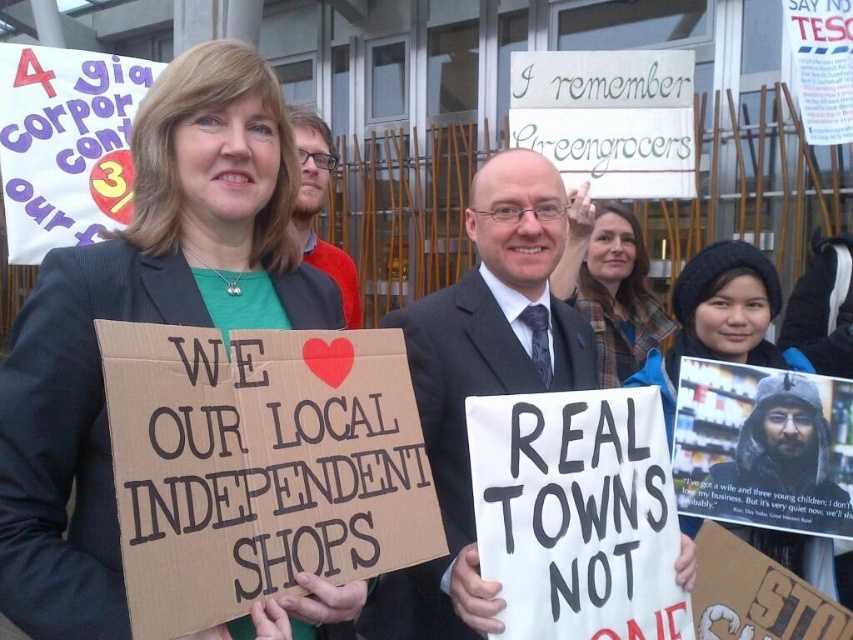
Can you confirm if blue knit hat at upper right is thinner than bearded man with glasses at center?

No.

Which of these two, blue knit hat at upper right or bearded man with glasses at center, stands shorter?

bearded man with glasses at center

Is point (726, 250) more distant than point (326, 269)?

No.

In order to click on blue knit hat at upper right in this screenshot , I will do `click(720, 320)`.

Between point (13, 522) and point (811, 554), which one is positioned behind?

Point (811, 554)

This screenshot has width=853, height=640. Describe the element at coordinates (143, 321) in the screenshot. I see `matte black blazer at center` at that location.

Describe the element at coordinates (143, 321) in the screenshot. I see `matte black blazer at center` at that location.

Where is `matte black blazer at center`? matte black blazer at center is located at coordinates (143, 321).

Who is positioned more to the left, matte black blazer at center or dark gray suit at center?

Positioned to the left is matte black blazer at center.

Which is more to the right, matte black blazer at center or dark gray suit at center?

Positioned to the right is dark gray suit at center.

This screenshot has width=853, height=640. What do you see at coordinates (143, 321) in the screenshot?
I see `matte black blazer at center` at bounding box center [143, 321].

I want to click on matte black blazer at center, so click(143, 321).